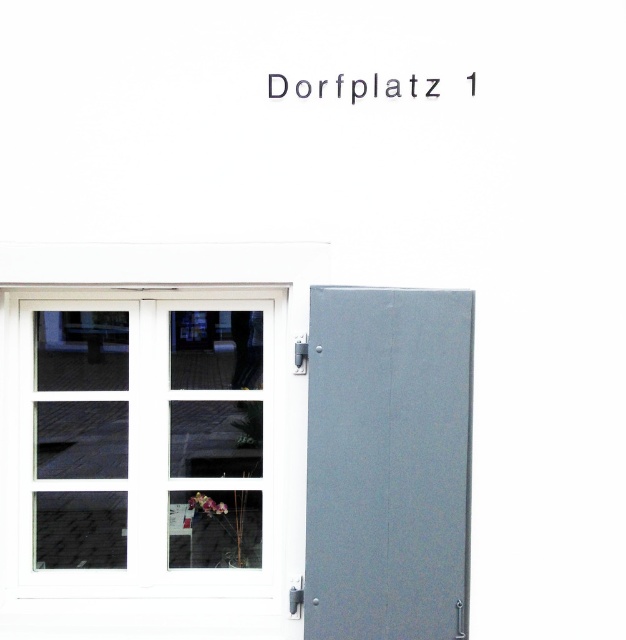
Does white glass window at center appear under gray matte door at right?

No.

Can you confirm if white glass window at center is positioned to the left of gray matte door at right?

Yes, white glass window at center is to the left of gray matte door at right.

Between point (222, 538) and point (436, 308), which one is positioned in front?

Positioned in front is point (436, 308).

Identify the location of white glass window at center. This screenshot has height=640, width=626. (145, 436).